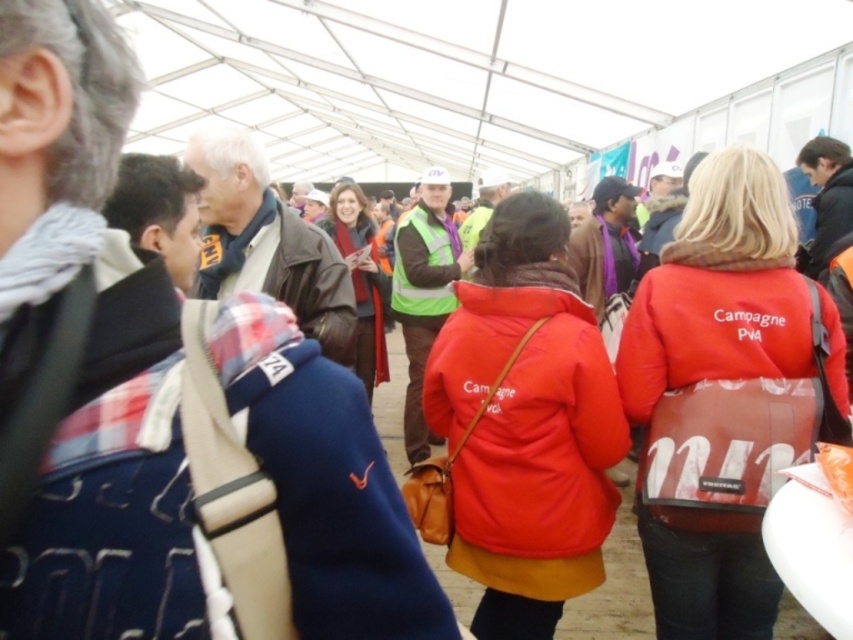
Who is taller, matte red jacket at center or red matte jacket at center?

matte red jacket at center is taller.

Looking at this image, can you confirm if matte red jacket at center is wider than red matte jacket at center?

Incorrect, matte red jacket at center's width does not surpass red matte jacket at center's.

Who is more forward, (430, 403) or (639, 381)?

Positioned in front is point (639, 381).

At what (x,y) coordinates should I click in order to perform the action: click on matte red jacket at center. Please return your answer as a coordinate pair (x, y). The image size is (853, 640). Looking at the image, I should click on (527, 433).

Between point (645, 408) and point (316, 289), which one is positioned in front?

Point (645, 408) is more forward.

Is point (840, 410) positioned behind point (332, 285)?

That is False.

Image resolution: width=853 pixels, height=640 pixels. What are the coordinates of `red matte jacket at center` in the screenshot? It's located at (711, 323).

Based on the photo, is leather jacket at center smaller than dark brown leather jacket at center?

Correct, leather jacket at center occupies less space than dark brown leather jacket at center.

Which is more to the left, leather jacket at center or dark brown leather jacket at center?

dark brown leather jacket at center

Who is more distant from viewer, (345, 330) or (361, 301)?

The point (361, 301) is more distant.

Where is `leather jacket at center`? leather jacket at center is located at coordinates (312, 284).